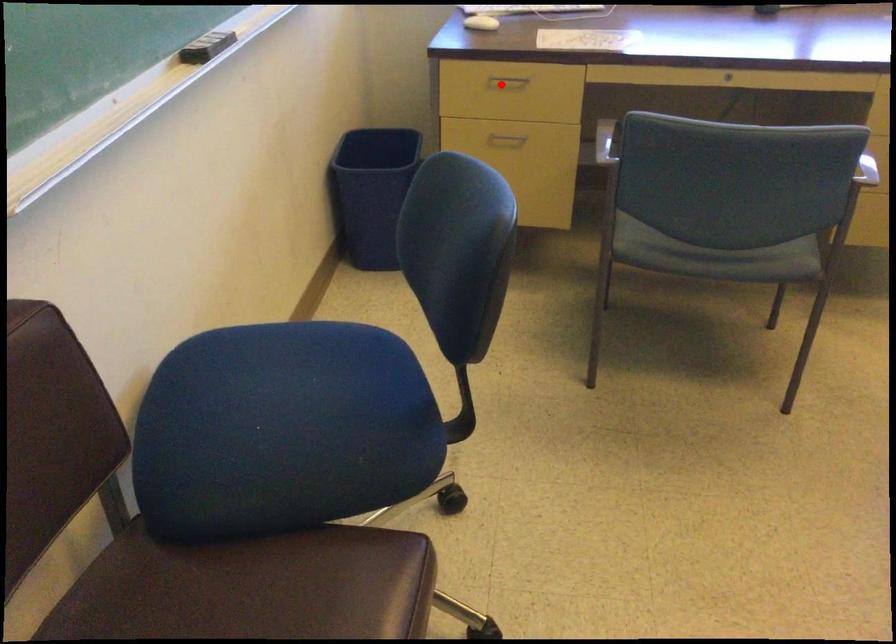
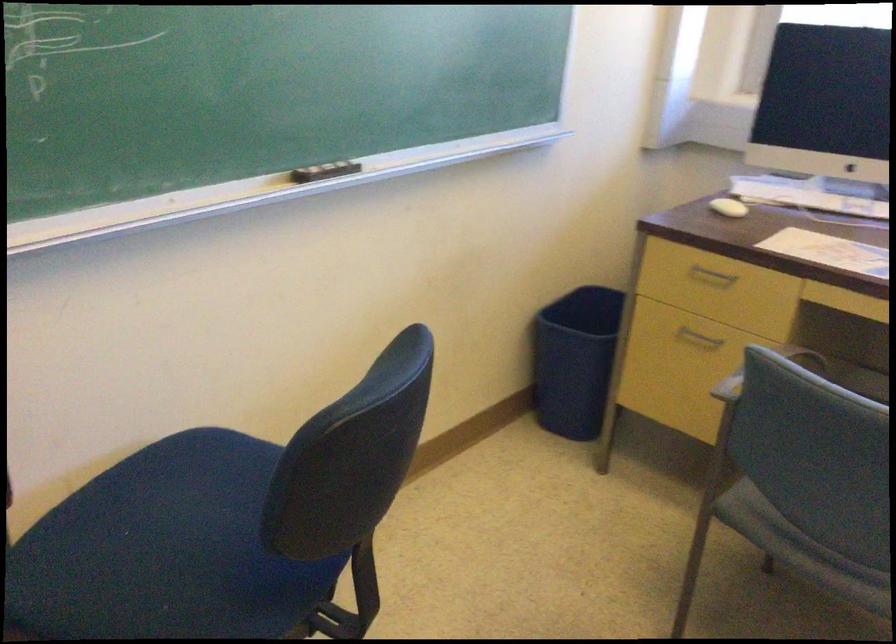
Question: I am providing you with two images of the same scene from different viewpoints. Given a red point in image1, look at the same physical point in image2. Is it:

Choices:
 (A) Closer to the viewpoint
 (B) Farther from the viewpoint

Answer: (A)